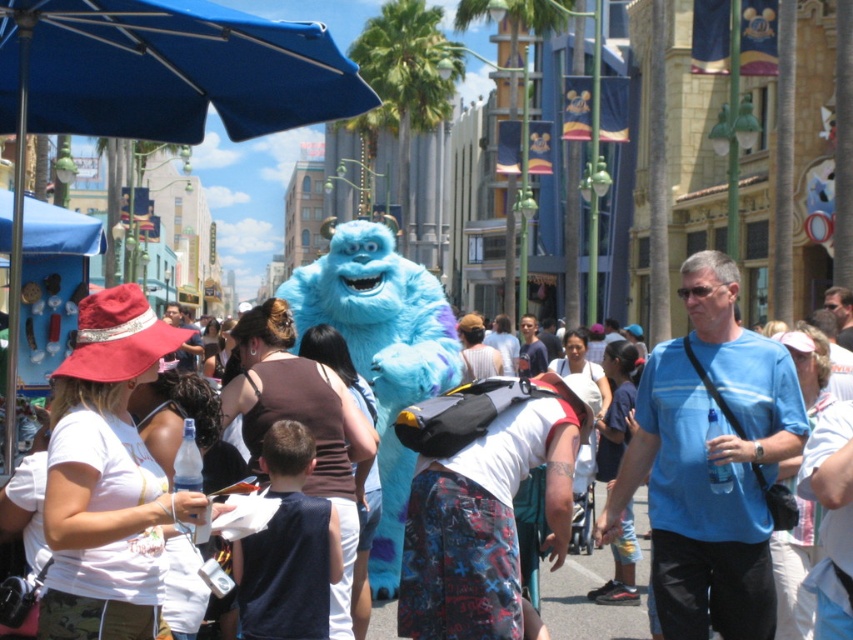
You are a photographer trying to capture a photo of the blue cotton shirt at center and the fuzzy blue costume at center. Since you want to focus on the smaller object, which one should you zoom in on?

The blue cotton shirt at center has a lesser width compared to the fuzzy blue costume at center, so you should zoom in on the blue cotton shirt at center to focus on the smaller object.

You are a photographer positioned at the center of the street scene. You want to take a photo that includes both the point at coordinates point [682,396] and point [325,637]. Which point should you focus on first to ensure both are in sharp focus?

You should focus on point [682,396] first because it is closer to you than point [325,637], ensuring both points are within the depth of field.

You are a photographer trying to capture both the blue cotton shirt at center and the dark blue fabric shirt at center in a single shot. Since you want to ensure both are visible, which shirt should you focus on first to make sure it isn

The blue cotton shirt at center is much taller than the dark blue fabric shirt at center, so you should focus on the blue cotton shirt at center first to ensure its height is properly captured in the frame.